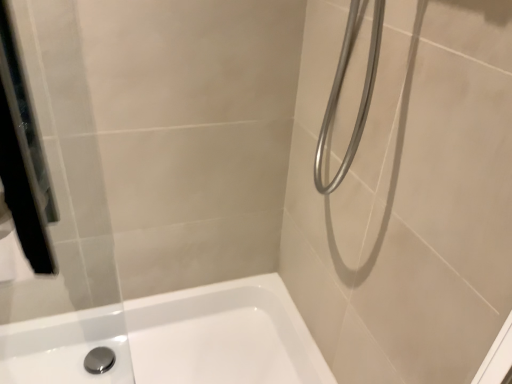
Describe the element at coordinates (173, 339) in the screenshot. Image resolution: width=512 pixels, height=384 pixels. I see `white glossy bathtub at lower left` at that location.

Measure the distance between white glossy bathtub at lower left and camera.

white glossy bathtub at lower left and camera are 1.11 meters apart.

What are the coordinates of `white glossy bathtub at lower left` in the screenshot? It's located at (173, 339).

Locate an element on the screen. white glossy bathtub at lower left is located at coordinates (173, 339).